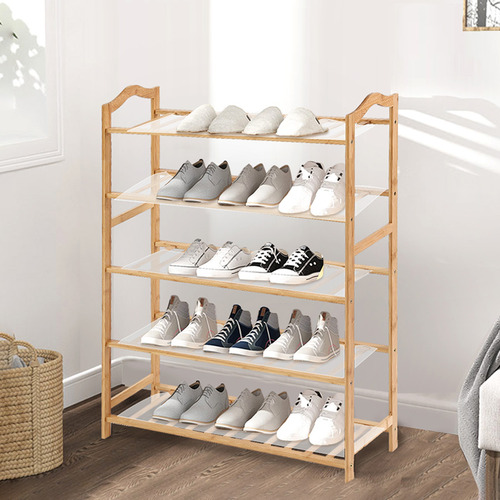
Identify the location of shelves. (159, 123), (142, 200), (149, 263), (135, 338), (140, 412).